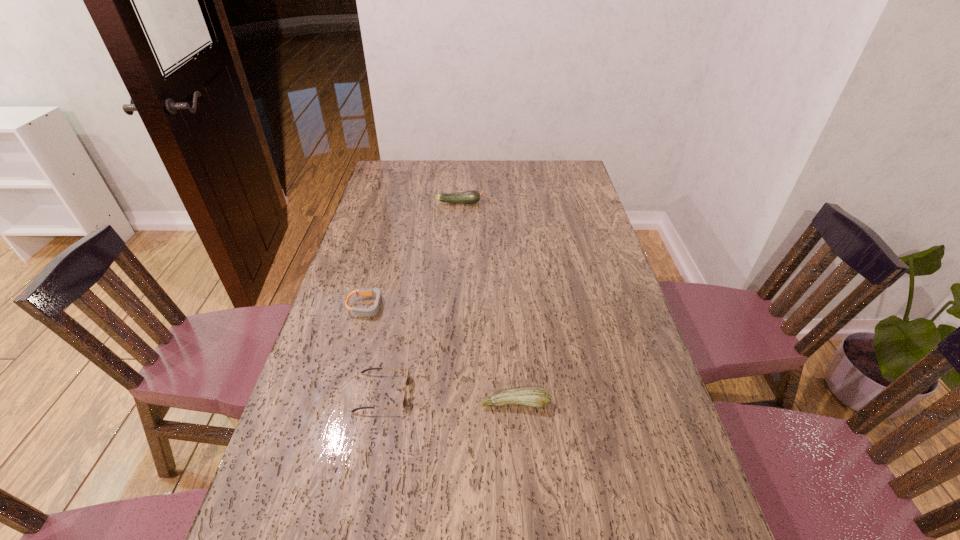
The width and height of the screenshot is (960, 540). I want to click on the farther zucchini, so click(472, 196).

This screenshot has width=960, height=540. In order to click on the nearer zucchini in this screenshot , I will do `click(537, 397)`.

Locate an element on the screen. This screenshot has width=960, height=540. sunglasses is located at coordinates (407, 382).

This screenshot has height=540, width=960. In order to click on the second farthest object in this screenshot , I will do `click(372, 311)`.

Where is `vacant space located at the blossom end of the farthest object`? Image resolution: width=960 pixels, height=540 pixels. vacant space located at the blossom end of the farthest object is located at coordinates (521, 202).

This screenshot has width=960, height=540. Find the location of `free space located at the stem end of the nearer zucchini`. free space located at the stem end of the nearer zucchini is located at coordinates click(x=524, y=530).

Locate an element on the screen. vacant area situated on the front-facing side of the sunglasses is located at coordinates (541, 393).

Find the location of a particular element. The height and width of the screenshot is (540, 960). vacant space located on the front and back of the third nearest object is located at coordinates (493, 306).

Locate an element on the screen. The image size is (960, 540). sunglasses located at the left edge is located at coordinates (407, 382).

Locate an element on the screen. This screenshot has width=960, height=540. goggles located at the left edge is located at coordinates (372, 311).